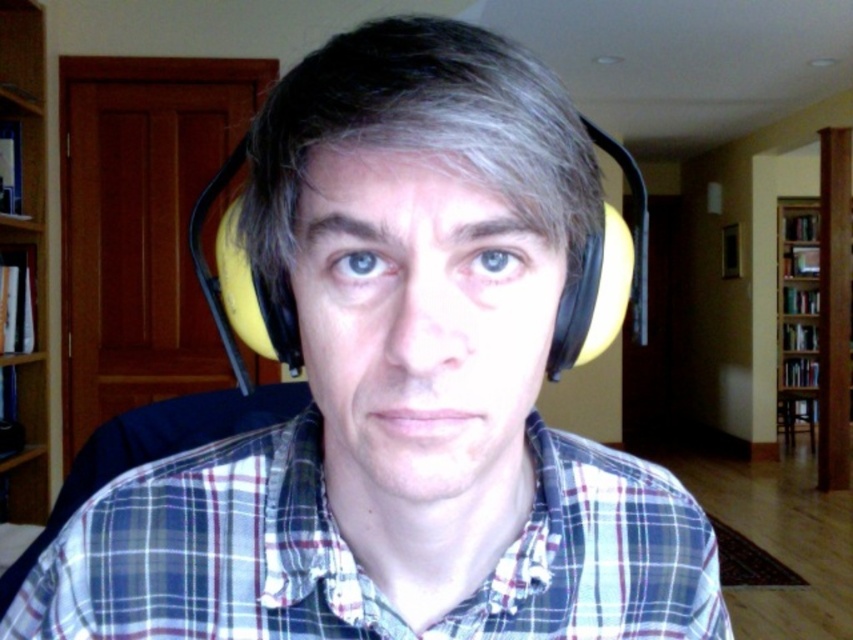
Question: Is plaid cotton shirt at center smaller than wooden bookshelf at right?

Choices:
 (A) yes
 (B) no

Answer: (A)

Question: Which object is the farthest from the wooden bookshelf at right?

Choices:
 (A) light brown wood bookshelf at left
 (B) plaid cotton shirt at center

Answer: (B)

Question: Does plaid cotton shirt at center lie in front of wooden bookshelf at right?

Choices:
 (A) yes
 (B) no

Answer: (A)

Question: Is light brown wood bookshelf at left below wooden bookshelf at right?

Choices:
 (A) yes
 (B) no

Answer: (B)

Question: Which object is farther from the camera taking this photo?

Choices:
 (A) light brown wood bookshelf at left
 (B) wooden bookshelf at right

Answer: (B)

Question: Which of the following is the closest to the observer?

Choices:
 (A) yellow foam ear protection at center
 (B) wooden bookshelf at right
 (C) plaid cotton shirt at center
 (D) light brown wood bookshelf at left

Answer: (A)